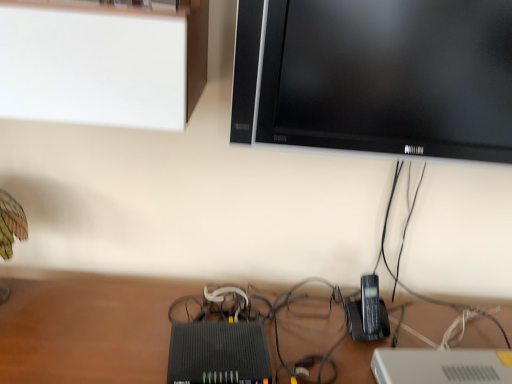
Question: Can you confirm if black plastic phone at lower right is shorter than black glossy tv at upper right?

Choices:
 (A) yes
 (B) no

Answer: (A)

Question: Is black plastic phone at lower right bigger than black glossy tv at upper right?

Choices:
 (A) yes
 (B) no

Answer: (B)

Question: From a real-world perspective, does black plastic phone at lower right sit lower than black glossy tv at upper right?

Choices:
 (A) no
 (B) yes

Answer: (B)

Question: Is the depth of black plastic phone at lower right greater than that of black glossy tv at upper right?

Choices:
 (A) no
 (B) yes

Answer: (B)

Question: Is black plastic phone at lower right at the right side of black glossy tv at upper right?

Choices:
 (A) no
 (B) yes

Answer: (A)

Question: Is black glossy tv at upper right a part of black plastic phone at lower right?

Choices:
 (A) no
 (B) yes

Answer: (A)

Question: Is black glossy tv at upper right shorter than black plastic phone at lower right?

Choices:
 (A) no
 (B) yes

Answer: (A)

Question: From the image's perspective, does black glossy tv at upper right appear lower than black plastic phone at lower right?

Choices:
 (A) no
 (B) yes

Answer: (A)

Question: Is the depth of black glossy tv at upper right less than that of black plastic phone at lower right?

Choices:
 (A) no
 (B) yes

Answer: (B)

Question: Are black glossy tv at upper right and black plastic phone at lower right far apart?

Choices:
 (A) yes
 (B) no

Answer: (B)

Question: Is black glossy tv at upper right oriented away from black plastic phone at lower right?

Choices:
 (A) no
 (B) yes

Answer: (A)

Question: From the image's perspective, is black glossy tv at upper right on black plastic phone at lower right?

Choices:
 (A) no
 (B) yes

Answer: (B)

Question: In terms of height, does black plastic phone at lower right look taller or shorter compared to black glossy tv at upper right?

Choices:
 (A) tall
 (B) short

Answer: (B)